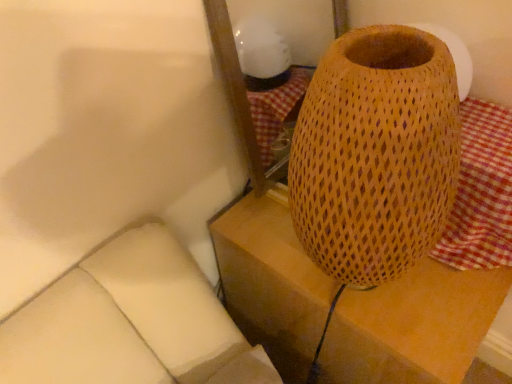
The height and width of the screenshot is (384, 512). What do you see at coordinates (481, 192) in the screenshot?
I see `red checkered fabric at right` at bounding box center [481, 192].

Measure the distance between red checkered fabric at right and camera.

red checkered fabric at right is 25.02 inches away from camera.

This screenshot has height=384, width=512. I want to click on red checkered fabric at right, so click(481, 192).

Describe the element at coordinates (413, 327) in the screenshot. I see `woven wood lampshade at right` at that location.

In order to click on woven wood lampshade at right in this screenshot , I will do `click(413, 327)`.

What is the approximate width of woven wood lampshade at right?

51.37 centimeters.

You are a GUI agent. You are given a task and a screenshot of the screen. Output one action in this format:
    pyautogui.click(x=<x>, y=<y>)
    Task: Click on the red checkered fabric at right
    
    Given the screenshot: What is the action you would take?
    pyautogui.click(x=481, y=192)

Consider the image. Which object is positioned more to the left, woven wood lampshade at right or red checkered fabric at right?

From the viewer's perspective, woven wood lampshade at right appears more on the left side.

Between woven wood lampshade at right and red checkered fabric at right, which one is positioned behind?

woven wood lampshade at right.

Which is further, (215, 248) or (466, 162)?

The point (215, 248) is more distant.

From the image's perspective, is woven wood lampshade at right above red checkered fabric at right?

Actually, woven wood lampshade at right appears below red checkered fabric at right in the image.

From a real-world perspective, is woven wood lampshade at right on red checkered fabric at right?

No, from a real-world perspective, woven wood lampshade at right is not above red checkered fabric at right.

From the picture: Considering the sizes of woven wood lampshade at right and red checkered fabric at right in the image, is woven wood lampshade at right wider or thinner than red checkered fabric at right?

Considering their sizes, woven wood lampshade at right looks broader than red checkered fabric at right.

Based on the photo, who is taller, woven wood lampshade at right or red checkered fabric at right?

woven wood lampshade at right.

Does woven wood lampshade at right have a smaller size compared to red checkered fabric at right?

Incorrect, woven wood lampshade at right is not smaller in size than red checkered fabric at right.

Is red checkered fabric at right completely or partially inside woven wood lampshade at right?

No.

Are woven wood lampshade at right and red checkered fabric at right far apart?

That's not correct — woven wood lampshade at right is a little close to red checkered fabric at right.

Is woven wood lampshade at right facing towards red checkered fabric at right?

No.

Where is `tablecloth on the right of woven wood lampshade at right`? The width and height of the screenshot is (512, 384). tablecloth on the right of woven wood lampshade at right is located at coordinates point(481,192).

Considering the relative positions of red checkered fabric at right and woven wood lampshade at right in the image provided, is red checkered fabric at right to the left or to the right of woven wood lampshade at right?

red checkered fabric at right is to the right of woven wood lampshade at right.

In the image, is red checkered fabric at right positioned in front of or behind woven wood lampshade at right?

Clearly, red checkered fabric at right is in front of woven wood lampshade at right.

Between point (506, 194) and point (338, 354), which one is positioned in front?

The point (506, 194) is more forward.

From the image's perspective, is red checkered fabric at right positioned above or below woven wood lampshade at right?

red checkered fabric at right is above woven wood lampshade at right.

From a real-world perspective, does red checkered fabric at right sit lower than woven wood lampshade at right?

No, from a real-world perspective, red checkered fabric at right is not beneath woven wood lampshade at right.

Which of these two, red checkered fabric at right or woven wood lampshade at right, is wider?

Wider between the two is woven wood lampshade at right.

Does red checkered fabric at right have a lesser height compared to woven wood lampshade at right?

Yes.

Considering the relative sizes of red checkered fabric at right and woven wood lampshade at right in the image provided, is red checkered fabric at right bigger than woven wood lampshade at right?

Incorrect, red checkered fabric at right is not larger than woven wood lampshade at right.

Is red checkered fabric at right spatially inside woven wood lampshade at right, or outside of it?

red checkered fabric at right exists outside the volume of woven wood lampshade at right.

Does red checkered fabric at right touch woven wood lampshade at right?

No, red checkered fabric at right is not beside woven wood lampshade at right.

Could you tell me if red checkered fabric at right is turned towards woven wood lampshade at right?

No, red checkered fabric at right is not facing towards woven wood lampshade at right.

What's the angular difference between red checkered fabric at right and woven wood lampshade at right's facing directions?

red checkered fabric at right and woven wood lampshade at right are facing 0.00145 degrees away from each other.

The image size is (512, 384). Find the location of `tablecloth in front of the woven wood lampshade at right`. tablecloth in front of the woven wood lampshade at right is located at coordinates (481, 192).

The image size is (512, 384). I want to click on furniture behind the red checkered fabric at right, so click(x=413, y=327).

Identify the location of furniture below the red checkered fabric at right (from the image's perspective). (413, 327).